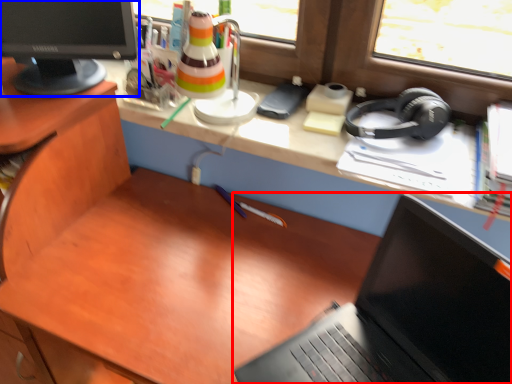
Question: Which object is closer to the camera taking this photo, laptop (highlighted by a red box) or computer monitor (highlighted by a blue box)?

Choices:
 (A) laptop
 (B) computer monitor

Answer: (A)